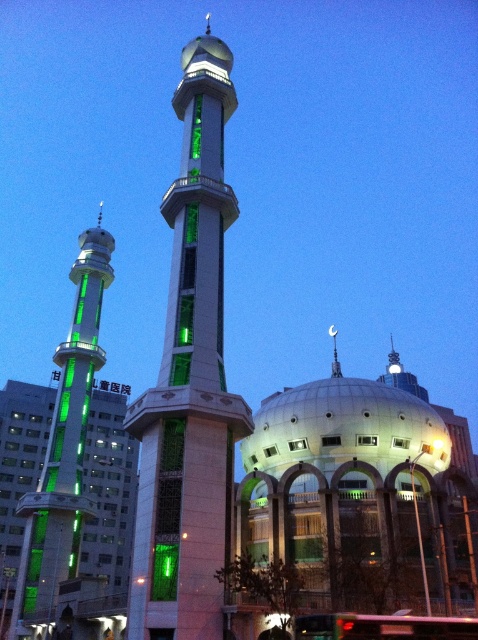
You are standing in front of the mosque and want to take a photo that includes both the green glass minaret at center and the green glass minaret at left. Which minaret should you frame closer to the camera to ensure both are visible in the shot?

You should frame the green glass minaret at left closer to the camera because it is smaller in size than the green glass minaret at center, allowing both to fit within the photo frame.